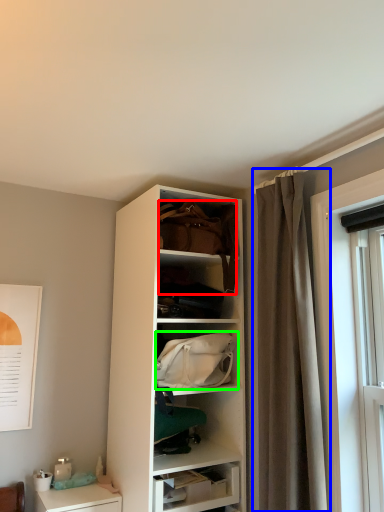
Question: Estimate the real-world distances between objects in this image. Which object is farther from handbag (highlighted by a red box), curtain (highlighted by a blue box) or handbag (highlighted by a green box)?

Choices:
 (A) curtain
 (B) handbag

Answer: (B)